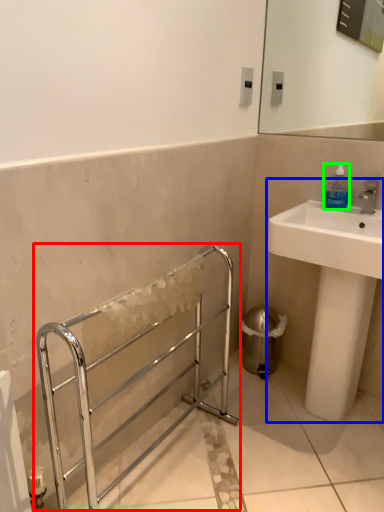
Question: Considering the real-world distances, which object is farthest from balustrade (highlighted by a red box)? sink (highlighted by a blue box) or bottle (highlighted by a green box)?

Choices:
 (A) sink
 (B) bottle

Answer: (B)